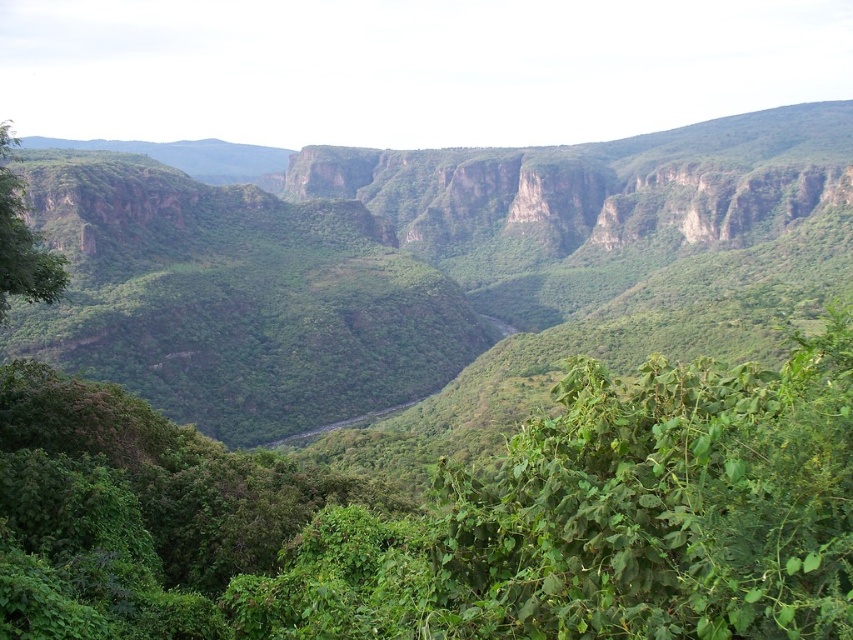
You are a photographer standing in the valley and want to take a photo that includes both the point at coordinates point (717, 316) and point (56, 298). Which point will appear closer to the bottom of the photo?

Point (56, 298) will appear closer to the bottom of the photo because it is closer to the camera than point (717, 316), which is further away.

You are a hiker planning to cross the valley. You notice the green leafy vegetation at center and the green leafy tree at left. Which one would block your view more if you stand in the middle of the valley?

The green leafy vegetation at center is taller than the green leafy tree at left, so it would block your view more if you stand in the middle of the valley.